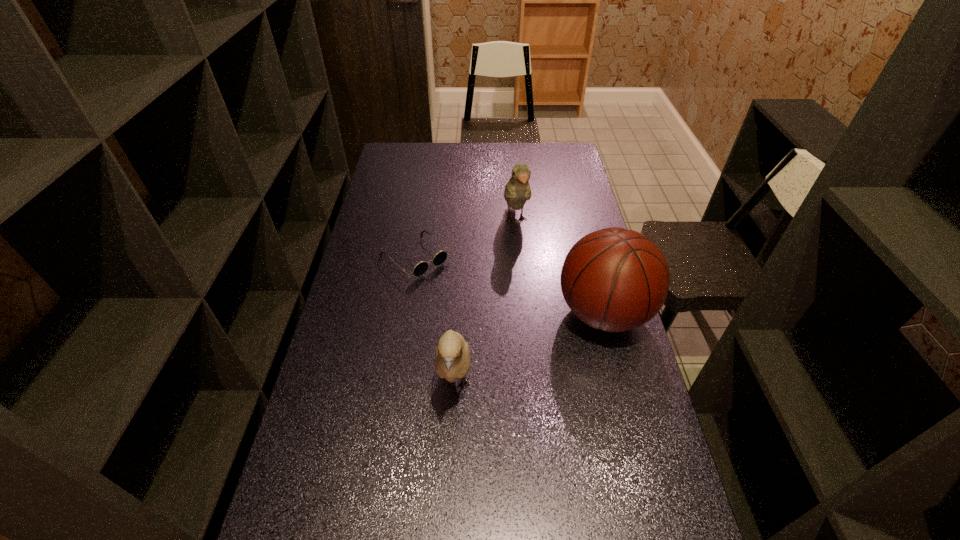
What are the coordinates of `vacant space situated 0.160m on the front-facing side of the shortest object` in the screenshot? It's located at (467, 303).

Image resolution: width=960 pixels, height=540 pixels. I want to click on free location located 0.190m on the front-facing side of the shortest object, so click(473, 308).

Locate an element on the screen. This screenshot has width=960, height=540. vacant space located 0.140m on the front-facing side of the shortest object is located at coordinates (463, 299).

Where is `object present at the left edge`? object present at the left edge is located at coordinates (420, 268).

This screenshot has height=540, width=960. In order to click on object that is at the right edge in this screenshot , I will do `click(614, 279)`.

Find the location of a particular element. The height and width of the screenshot is (540, 960). vacant space at the far edge of the desktop is located at coordinates (463, 160).

At what (x,y) coordinates should I click in order to perform the action: click on free region at the left edge of the desktop. Please return your answer as a coordinate pair (x, y). The height and width of the screenshot is (540, 960). Looking at the image, I should click on (403, 179).

You are a GUI agent. You are given a task and a screenshot of the screen. Output one action in this format:
    pyautogui.click(x=<x>, y=<y>)
    Task: Click on the vacant region at the right edge of the desktop
    This screenshot has height=540, width=960.
    Given the screenshot: What is the action you would take?
    pyautogui.click(x=595, y=403)

At what (x,y) coordinates should I click in order to perform the action: click on vacant area that lies between the basketball and the farther bird. Please return your answer as a coordinate pair (x, y). Looking at the image, I should click on (560, 267).

The width and height of the screenshot is (960, 540). What are the coordinates of `free space between the shortest object and the basketball` in the screenshot? It's located at pyautogui.click(x=510, y=285).